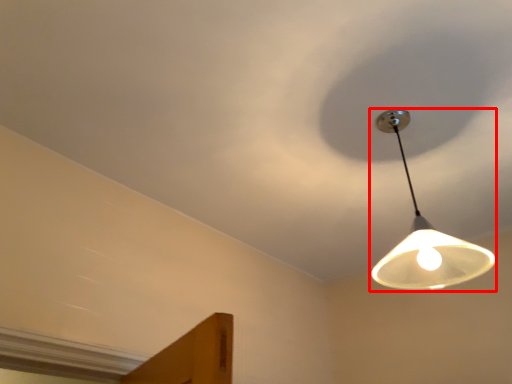
Question: From the image, what is the correct spatial relationship of lamp (annotated by the red box) in relation to cloud?

Choices:
 (A) right
 (B) left

Answer: (A)